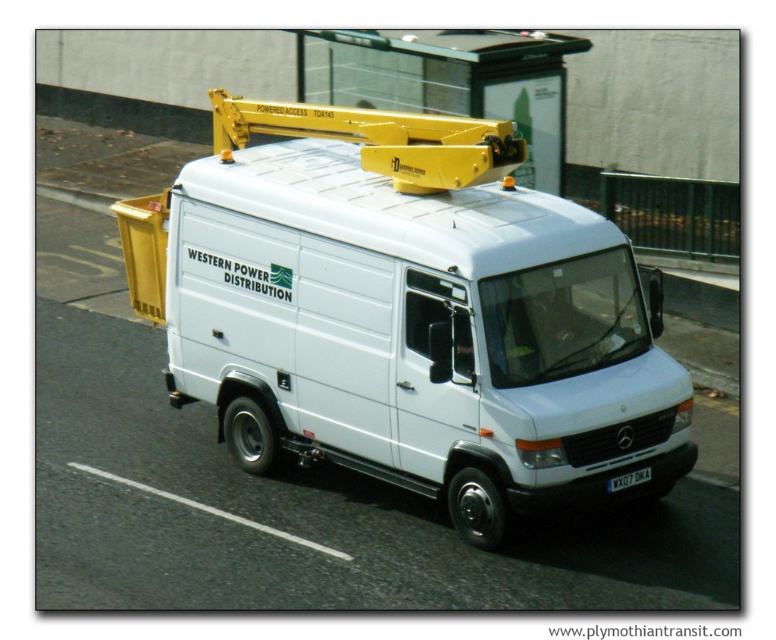
Question: Is white matte van at center to the left of black plastic license plate at center from the viewer's perspective?

Choices:
 (A) yes
 (B) no

Answer: (A)

Question: Does white matte van at center appear on the left side of black plastic license plate at center?

Choices:
 (A) yes
 (B) no

Answer: (A)

Question: Among these points, which one is nearest to the camera?

Choices:
 (A) tap(638, 444)
 (B) tap(639, 470)

Answer: (B)

Question: Which point appears farthest from the camera in this image?

Choices:
 (A) [629, 481]
 (B) [345, 330]

Answer: (B)

Question: Can you confirm if white matte van at center is positioned to the right of black plastic license plate at center?

Choices:
 (A) yes
 (B) no

Answer: (B)

Question: Among these points, which one is farthest from the camera?

Choices:
 (A) (634, 476)
 (B) (425, 410)

Answer: (B)